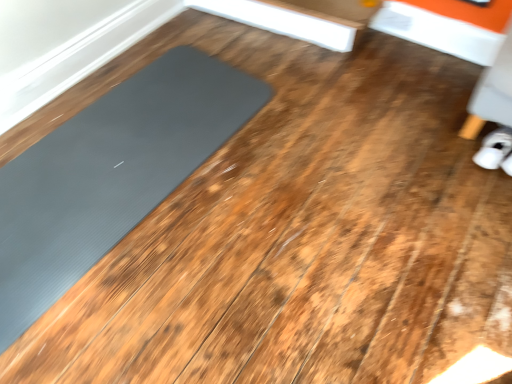
Question: Considering the positions of white fabric shoe at lower right and gray rubber mat at left in the image, is white fabric shoe at lower right taller or shorter than gray rubber mat at left?

Choices:
 (A) short
 (B) tall

Answer: (B)

Question: In terms of size, does white fabric shoe at lower right appear bigger or smaller than gray rubber mat at left?

Choices:
 (A) small
 (B) big

Answer: (A)

Question: In the image, is white fabric shoe at lower right positioned in front of or behind gray rubber mat at left?

Choices:
 (A) behind
 (B) front

Answer: (A)

Question: From the image's perspective, is gray rubber mat at left above or below white fabric shoe at lower right?

Choices:
 (A) above
 (B) below

Answer: (B)

Question: Is gray rubber mat at left bigger or smaller than white fabric shoe at lower right?

Choices:
 (A) big
 (B) small

Answer: (A)

Question: Is gray rubber mat at left to the left or to the right of white fabric shoe at lower right in the image?

Choices:
 (A) left
 (B) right

Answer: (A)

Question: Relative to white fabric shoe at lower right, is gray rubber mat at left in front or behind?

Choices:
 (A) behind
 (B) front

Answer: (B)